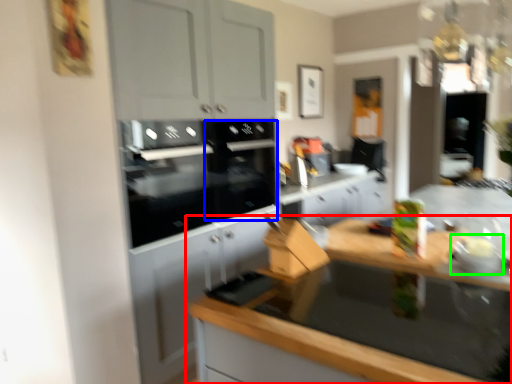
Question: Which is farther away from countertop (highlighted by a red box)? appliance (highlighted by a blue box) or appliance (highlighted by a green box)?

Choices:
 (A) appliance
 (B) appliance

Answer: (A)